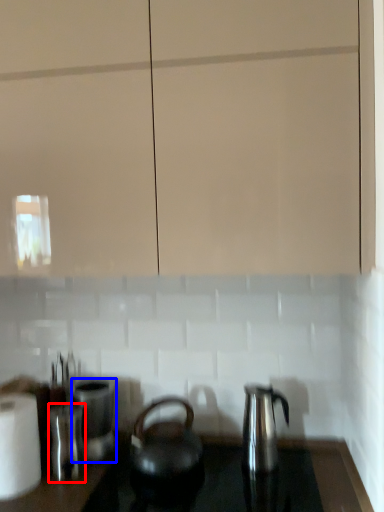
Question: Which object appears farthest to the camera in this image, appliance (highlighted by a red box) or appliance (highlighted by a blue box)?

Choices:
 (A) appliance
 (B) appliance

Answer: (B)